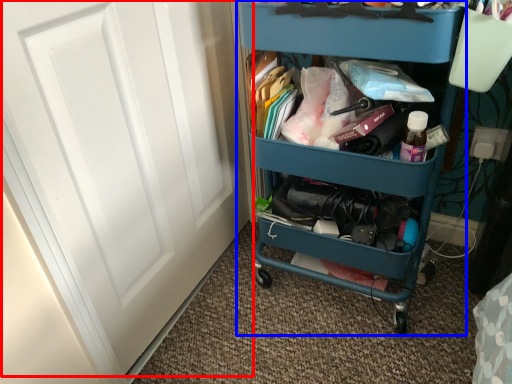
Question: Which point is closer to the camera, door (highlighted by a red box) or furniture (highlighted by a blue box)?

Choices:
 (A) door
 (B) furniture

Answer: (A)